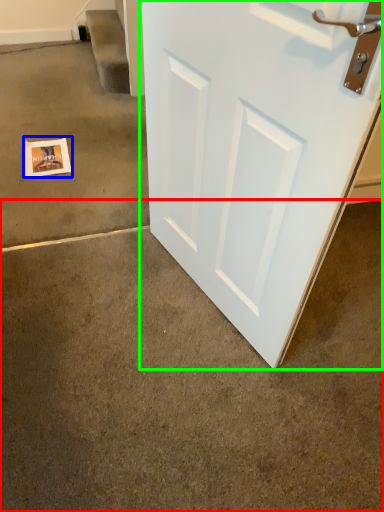
Question: Which is nearer to the concrete (highlighted by a red box)? postcard (highlighted by a blue box) or door (highlighted by a green box).

Choices:
 (A) postcard
 (B) door

Answer: (B)